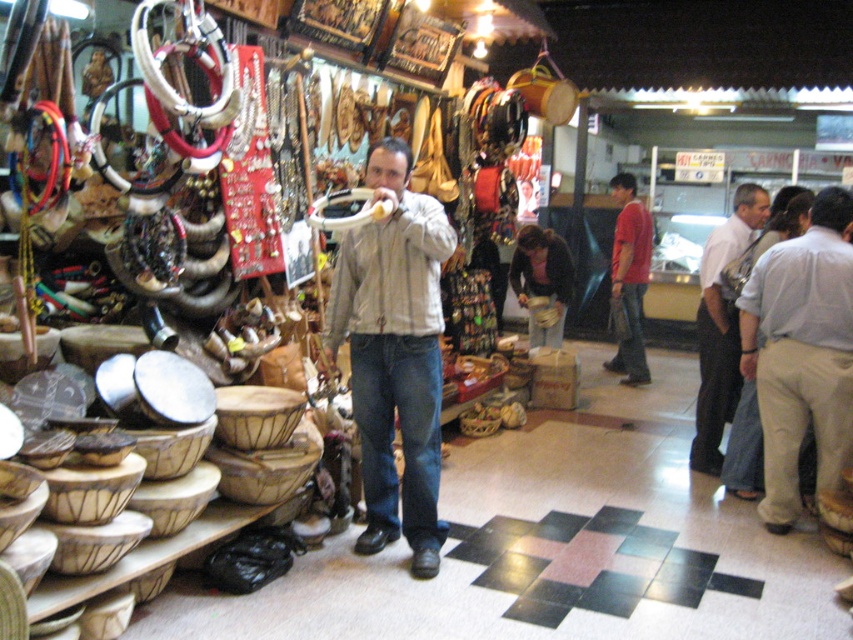
Which is more to the left, light beige jacket at center or dark brown leather jacket at center?

From the viewer's perspective, light beige jacket at center appears more on the left side.

Between light beige jacket at center and dark brown leather jacket at center, which one is positioned higher?

dark brown leather jacket at center is above.

Is point (390, 493) positioned behind point (529, 296)?

No, it is not.

Identify the location of light beige jacket at center. Image resolution: width=853 pixels, height=640 pixels. (393, 353).

Looking at this image, is light gray shirt at center smaller than red cotton shirt at center?

Yes.

Between point (837, 364) and point (643, 205), which one is positioned in front?

Point (837, 364)

Does point (830, 221) lie behind point (631, 266)?

No.

Find the location of a particular element. The image size is (853, 640). light gray shirt at center is located at coordinates (801, 353).

Is light brown leather tie at right to the left of red cotton shirt at center from the viewer's perspective?

Yes, light brown leather tie at right is to the left of red cotton shirt at center.

Does light brown leather tie at right have a greater height compared to red cotton shirt at center?

No, light brown leather tie at right is not taller than red cotton shirt at center.

Which is behind, point (730, 332) or point (630, 332)?

Point (630, 332)

Where is `light brown leather tie at right`? light brown leather tie at right is located at coordinates pyautogui.click(x=721, y=326).